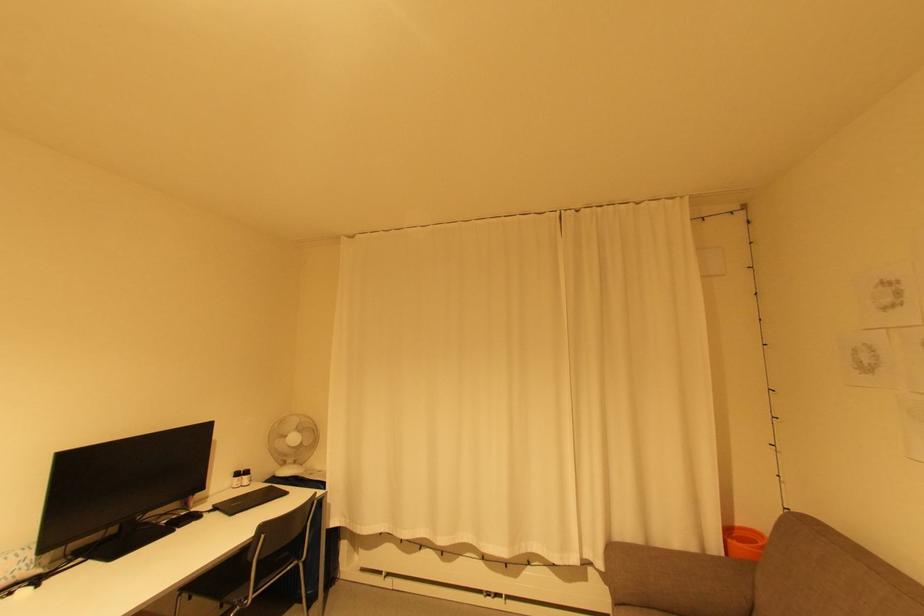
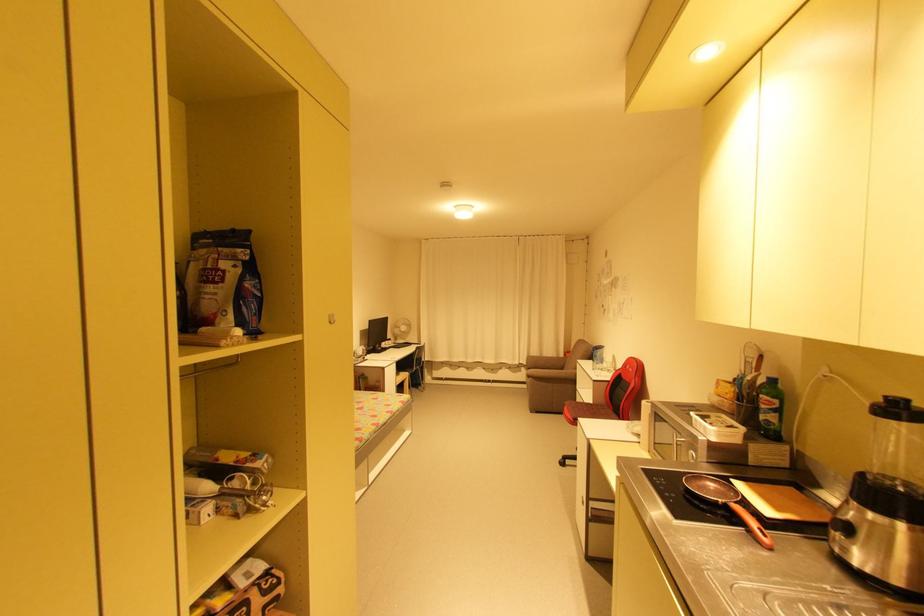
Question: The images are taken continuously from a first-person perspective. In which direction are you moving?

Choices:
 (A) Left
 (B) Right
 (C) Forward
 (D) Backward

Answer: (D)